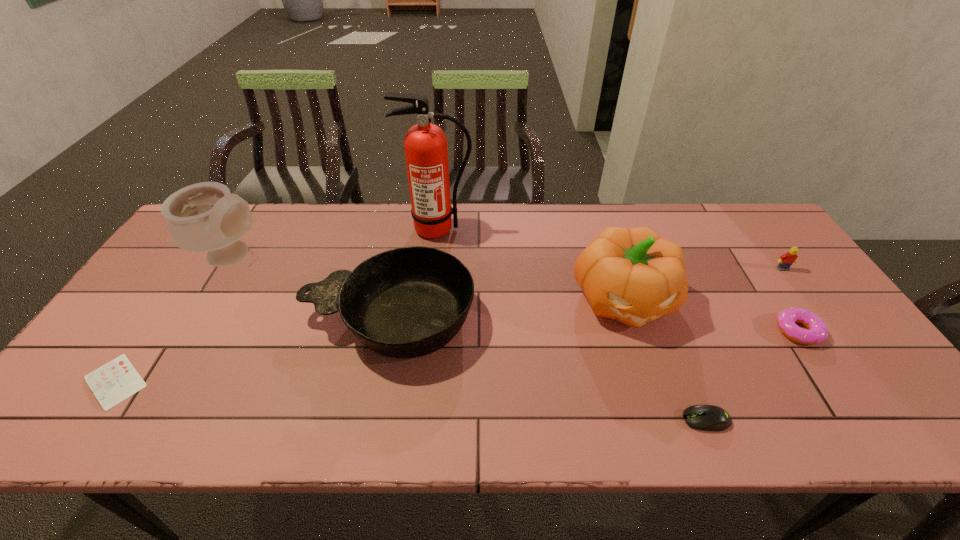
Find the location of a particular element. This screenshot has width=960, height=540. fire extinguisher at the far edge is located at coordinates (426, 151).

At what (x,y) coordinates should I click in order to perform the action: click on pottery at the far edge. Please return your answer as a coordinate pair (x, y). Image resolution: width=960 pixels, height=540 pixels. Looking at the image, I should click on (204, 217).

You are a GUI agent. You are given a task and a screenshot of the screen. Output one action in this format:
    pyautogui.click(x=<x>, y=<y>)
    Task: Click on the computer mouse at the near edge
    Image resolution: width=960 pixels, height=540 pixels.
    Given the screenshot: What is the action you would take?
    pyautogui.click(x=702, y=417)

You are a GUI agent. You are given a task and a screenshot of the screen. Output one action in this format:
    pyautogui.click(x=<x>, y=<y>)
    Task: Click on the diary positioned at the near edge
    The height and width of the screenshot is (540, 960).
    Given the screenshot: What is the action you would take?
    pyautogui.click(x=117, y=380)

Identify the location of pottery that is at the left edge. The width and height of the screenshot is (960, 540). (204, 217).

At what (x,y) coordinates should I click in order to perform the action: click on diary that is at the left edge. Please return your answer as a coordinate pair (x, y). Image resolution: width=960 pixels, height=540 pixels. Looking at the image, I should click on (117, 380).

This screenshot has width=960, height=540. Identify the location of Lego that is at the right edge. (786, 260).

Identify the location of doughnut at the right edge. (817, 332).

Identify the location of object that is positioned at the far left corner. (204, 217).

Where is `object that is at the near left corner`? This screenshot has width=960, height=540. object that is at the near left corner is located at coordinates (117, 380).